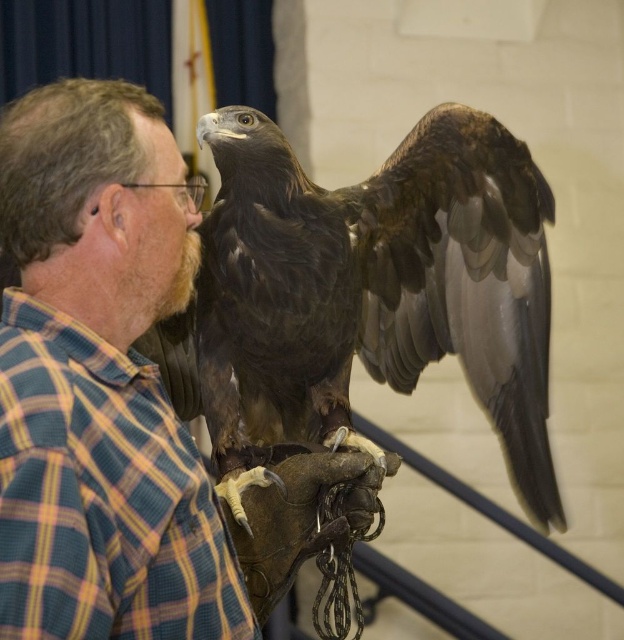
Question: Is the position of brown feathered falcon at center more distant than that of plaid cotton shirt at upper left?

Choices:
 (A) no
 (B) yes

Answer: (B)

Question: Among these points, which one is nearest to the camera?

Choices:
 (A) (168, 456)
 (B) (366, 282)

Answer: (A)

Question: From the image, what is the correct spatial relationship of brown feathered falcon at center in relation to plaid cotton shirt at upper left?

Choices:
 (A) above
 (B) below

Answer: (A)

Question: Does brown feathered falcon at center have a lesser width compared to plaid cotton shirt at upper left?

Choices:
 (A) no
 (B) yes

Answer: (A)

Question: Which object is farther from the camera taking this photo?

Choices:
 (A) plaid cotton shirt at upper left
 (B) brown feathered falcon at center

Answer: (B)

Question: Which point is closer to the camera?

Choices:
 (A) plaid cotton shirt at upper left
 (B) brown feathered falcon at center

Answer: (A)